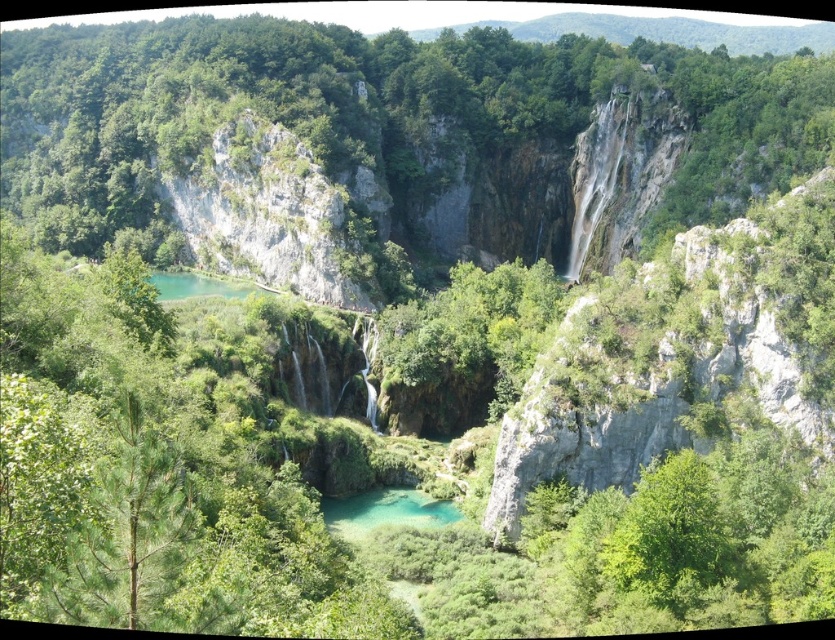
You are a hiker standing at the base of the waterfall on the right. You notice a green leafy tree at center and a turquoise glossy water at center. Which object is closer to your right side?

The green leafy tree at center is to the right of the turquoise glossy water at center, so it is closer to your right side.

You are a hiker standing at the base of the waterfall on the right. You see the green matte tree at left and the turquoise glossy water at center. Which object is closer to your current position?

The green matte tree at left is positioned over the turquoise glossy water at center, meaning it is closer to your current position at the base of the waterfall on the right.

You are a drone operator trying to capture the green leafy tree at center in your camera frame. Your camera has a 10cm x 10cm sensor. The tree is located at coordinates 0.223, 0.477 in the image. Can you determine if the tree will fit entirely within the sensor?

The green leafy tree at center is located at coordinates (397, 141). Since the sensor size is 10cm x 10cm, the tree will fit entirely within the sensor as long as its dimensions are smaller than or equal to 10cm in both width and height. However, without knowing the actual size of the tree in the real world, it is impossible to determine if it will fit within the sensor. Please provide more information about the tree size.